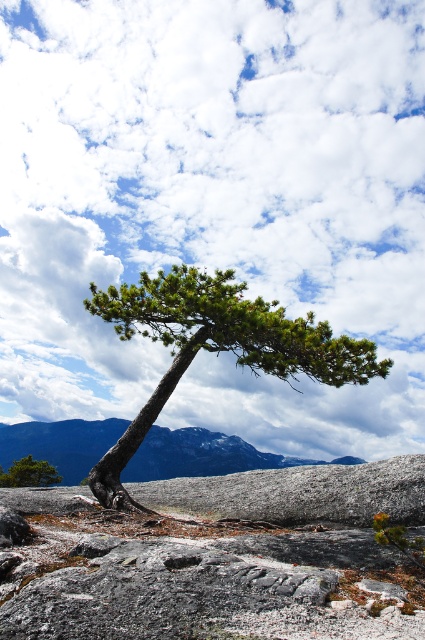
You are a hiker standing at the base of the green textured pine tree at center and want to compare its size with the green matte tree at lower left. Which tree has a greater width?

The green textured pine tree at center has a greater width than the green matte tree at lower left.

You are a hiker planning to climb the gray rocky mountain at center and also want to pass by the green matte tree at lower left. Based on the scene, which object should you encounter first while ascending the mountain?

The green matte tree at lower left should be encountered first because the gray rocky mountain at center is below it, meaning the tree is positioned higher up the mountain and would be reached before ascending further.